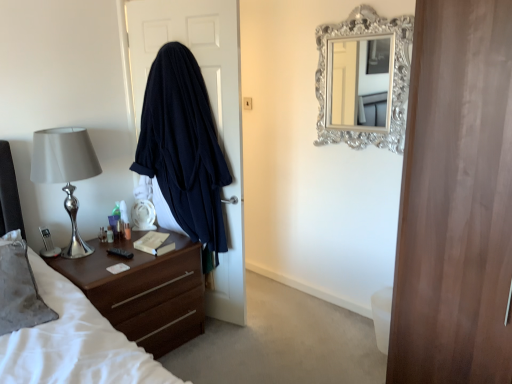
You are a GUI agent. You are given a task and a screenshot of the screen. Output one action in this format:
    pyautogui.click(x=<x>, y=<y>)
    Task: Click on the free area in between silver metallic lamp at left and black plastic remote control at left
    The height and width of the screenshot is (384, 512).
    Given the screenshot: What is the action you would take?
    pyautogui.click(x=110, y=262)